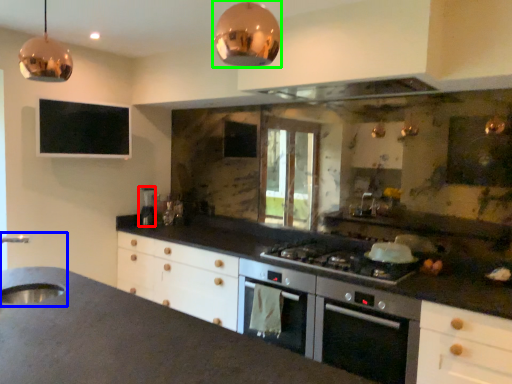
Question: Estimate the real-world distances between objects in this image. Which object is closer to appliance (highlighted by a red box), sink (highlighted by a blue box) or light fixture (highlighted by a green box)?

Choices:
 (A) sink
 (B) light fixture

Answer: (A)